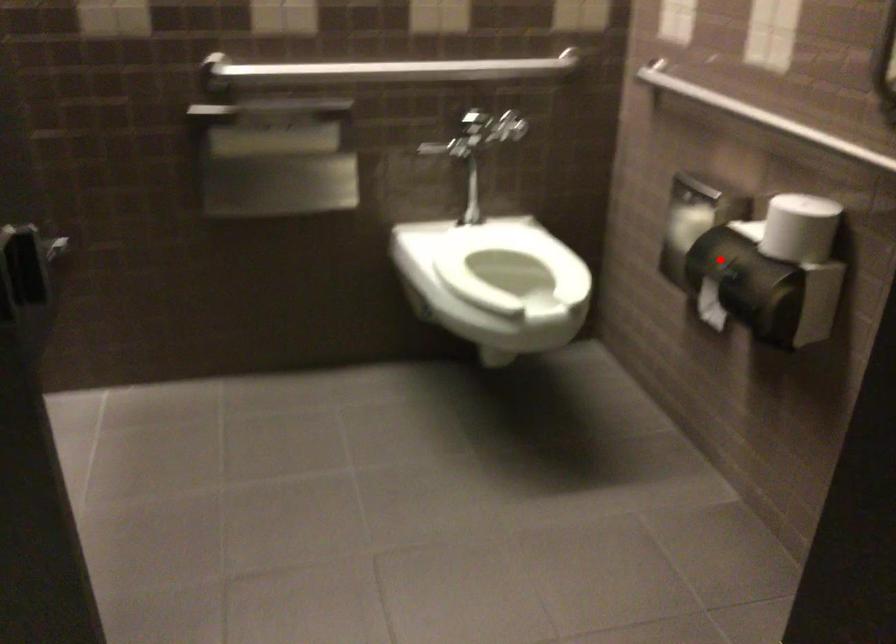
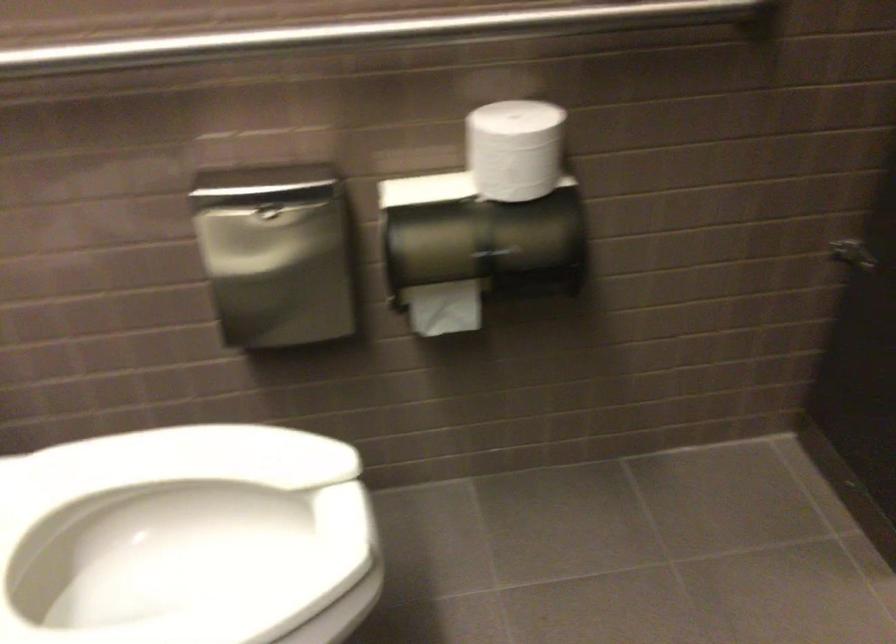
Question: I am providing you with two images of the same scene from different viewpoints. A red point is shown in image1. For the corresponding object point in image2, is it positioned nearer or farther from the camera?

Choices:
 (A) Nearer
 (B) Farther

Answer: (A)